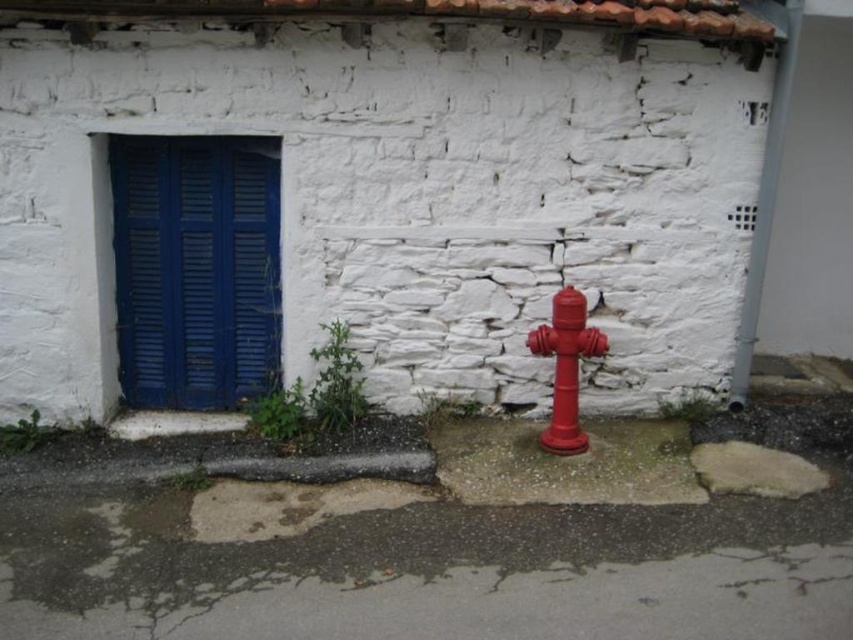
You are a delivery person trying to place a box on the blue painted wood at left and the smooth concrete curb at lower left. Which surface can you place the box on without it being too low to the ground?

The blue painted wood at left has a greater height compared to the smooth concrete curb at lower left, so you can place the box on the blue painted wood at left to avoid it being too low to the ground.

You are an architect examining the building facade. You notice a specific coordinate point on the image. What material is present at the point labeled as point (x=195, y=269)?

The point (x=195, y=269) indicates blue painted wood at left.